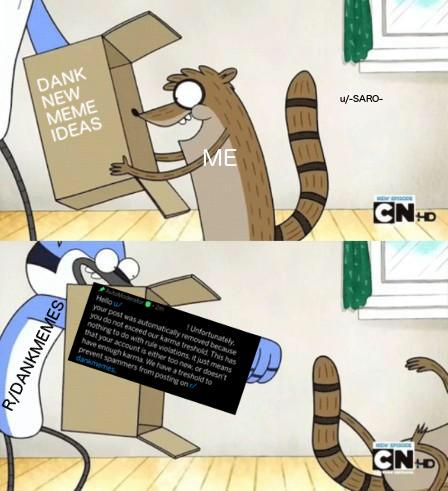
This screenshot has width=448, height=491. In order to click on drapes in this screenshot , I will do `click(360, 26)`, `click(357, 278)`.